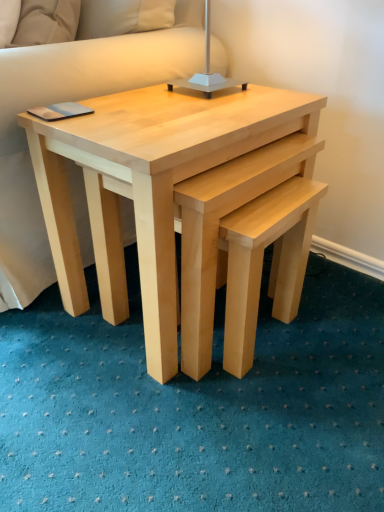
I want to click on vacant position to the left of metallic silver table lamp at upper center, so click(x=135, y=96).